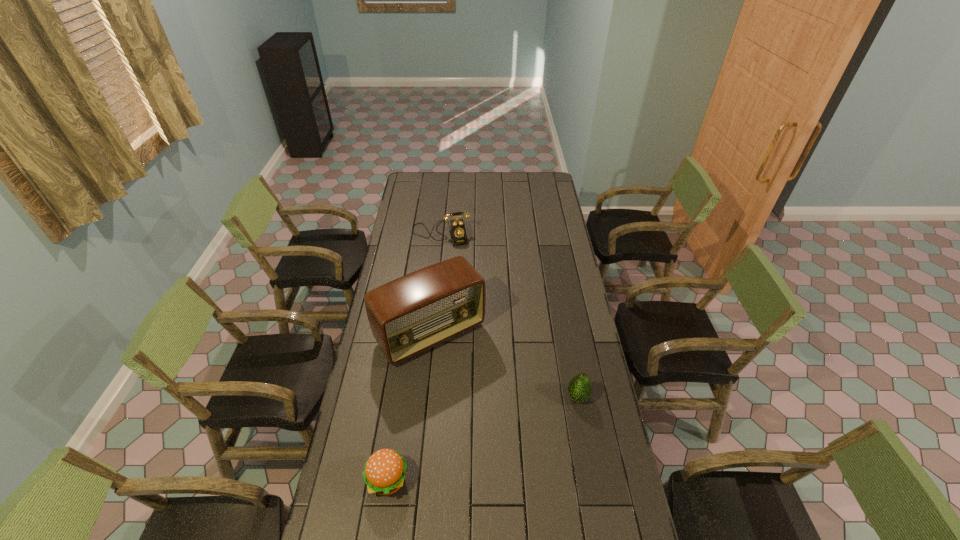
The width and height of the screenshot is (960, 540). Find the location of `the nearest object`. the nearest object is located at coordinates (384, 473).

The width and height of the screenshot is (960, 540). I want to click on the second nearest object, so click(579, 388).

Locate an element on the screen. the rightmost object is located at coordinates (579, 388).

Where is `the tallest object`? Image resolution: width=960 pixels, height=540 pixels. the tallest object is located at coordinates [x=409, y=315].

Identify the location of the third nearest object. (409, 315).

Identify the location of telephone. This screenshot has width=960, height=540. (458, 232).

You are a GUI agent. You are given a task and a screenshot of the screen. Output one action in this format:
    pyautogui.click(x=<x>, y=<y>)
    Task: Click on the vacant space located 0.120m on the right of the hamburger
    The image size is (960, 540).
    Given the screenshot: What is the action you would take?
    pyautogui.click(x=446, y=481)

Find the location of a particular element. free space located on the front of the rightmost object is located at coordinates (590, 468).

Identify the location of free space located on the front-facing side of the third nearest object. (471, 384).

This screenshot has width=960, height=540. Identify the location of vacant area situated 0.370m on the front-facing side of the third nearest object. (513, 441).